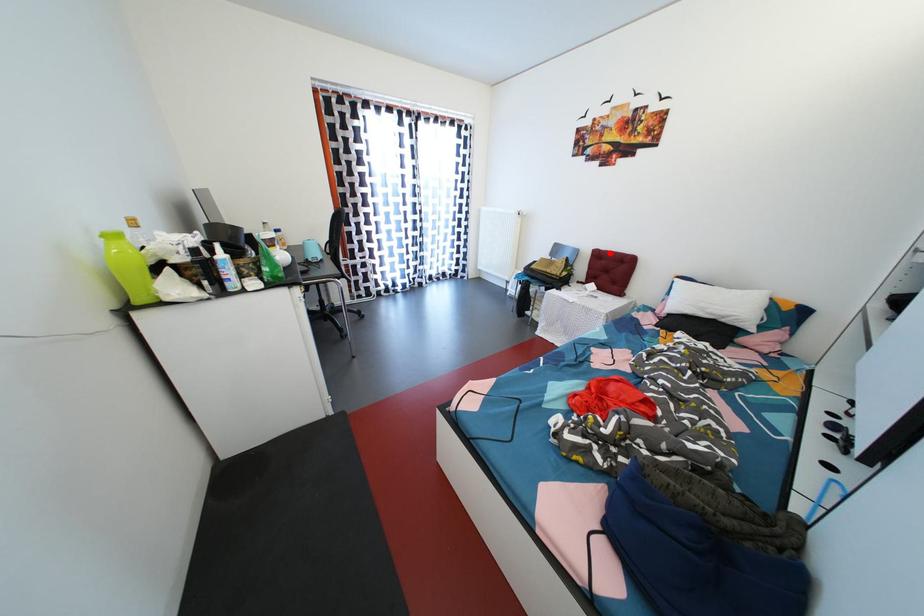
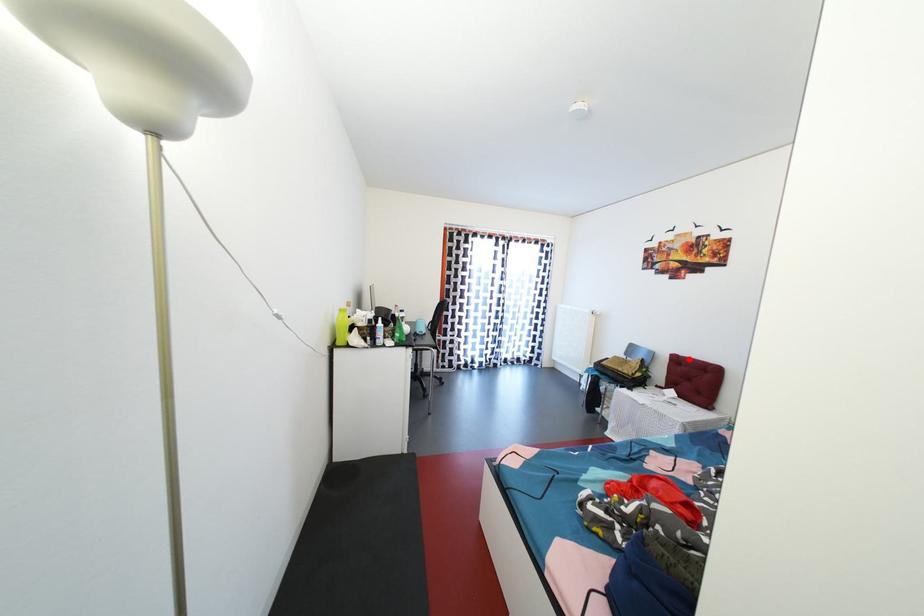
I am providing you with two images of the same scene from different viewpoints. A red point is marked on the first image and another point is marked on the second image. Does the point marked in image1 correspond to the same location as the one in image2?

Yes